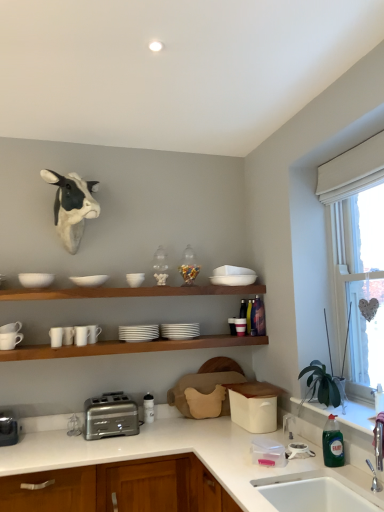
Where is `white matte mug at upper left, the 2th tableware positioned from the left`? The height and width of the screenshot is (512, 384). white matte mug at upper left, the 2th tableware positioned from the left is located at coordinates [56, 337].

What do you see at coordinates (36, 280) in the screenshot?
I see `white matte bowl at upper left, the second mixing bowl from the right` at bounding box center [36, 280].

This screenshot has width=384, height=512. Identify the location of beige plastic bread bin at lower center, which appears as the first appliance when viewed from the right. (254, 405).

The height and width of the screenshot is (512, 384). I want to click on white matte mug at upper left, which ranks as the 7th tableware in right-to-left order, so click(56, 337).

Would you say green glass bottle at lower right is to the left or to the right of white matte cow head at upper left in the picture?

Clearly, green glass bottle at lower right is on the right of white matte cow head at upper left in the image.

Can you see green glass bottle at lower right touching white matte cow head at upper left?

green glass bottle at lower right and white matte cow head at upper left are not in contact.

Can you confirm if green glass bottle at lower right is wider than white matte cow head at upper left?

No, green glass bottle at lower right is not wider than white matte cow head at upper left.

Can you confirm if white matte plates at center, arranged as the 1th tableware when viewed from the right, is positioned to the left of white glossy countertop at lower center?

In fact, white matte plates at center, arranged as the 1th tableware when viewed from the right, is to the right of white glossy countertop at lower center.

Based on the photo, from the image's perspective, does white matte plates at center, arranged as the 1th tableware when viewed from the right, appear higher than white glossy countertop at lower center?

Yes, from the image's perspective, white matte plates at center, arranged as the 1th tableware when viewed from the right, is above white glossy countertop at lower center.

Between white matte plates at center, which ranks as the eighth tableware in left-to-right order, and white glossy countertop at lower center, which one is positioned in front?

Positioned in front is white glossy countertop at lower center.

Would you consider white matte plates at center, arranged as the 1th tableware when viewed from the right, to be distant from white glossy countertop at lower center?

No, white matte plates at center, arranged as the 1th tableware when viewed from the right, is in close proximity to white glossy countertop at lower center.

Considering the relative sizes of white ceramic sink at lower right, which is counted as the first sink, starting from the top, and green glass bottle at lower right in the image provided, is white ceramic sink at lower right, which is counted as the first sink, starting from the top, taller than green glass bottle at lower right?

In fact, white ceramic sink at lower right, which is counted as the first sink, starting from the top, may be shorter than green glass bottle at lower right.

Who is smaller, white ceramic sink at lower right, the 2th sink in the bottom-to-top sequence, or green glass bottle at lower right?

green glass bottle at lower right.

From the image's perspective, which is above, white ceramic sink at lower right, which is counted as the first sink, starting from the top, or green glass bottle at lower right?

green glass bottle at lower right is shown above in the image.

Is white ceramic sink at lower right, which is counted as the first sink, starting from the top, not inside green glass bottle at lower right?

That's correct, white ceramic sink at lower right, which is counted as the first sink, starting from the top, is outside of green glass bottle at lower right.

Is white matte bowl at upper center, acting as the second mixing bowl starting from the left, aimed at white matte mug at upper left, which is counted as the 5th tableware, starting from the left?

No, white matte bowl at upper center, acting as the second mixing bowl starting from the left, is not aimed at white matte mug at upper left, which is counted as the 5th tableware, starting from the left.

In the scene shown: Is white matte bowl at upper center, positioned as the first mixing bowl in right-to-left order, with white matte mug at upper left, the 4th tableware positioned from the right?

They are not placed beside each other.

Between white matte bowl at upper center, acting as the second mixing bowl starting from the left, and white matte mug at upper left, which is counted as the 5th tableware, starting from the left, which one has more height?

white matte mug at upper left, which is counted as the 5th tableware, starting from the left, is taller.

Where is `the 1st mixing bowl in front of the white matte mug at upper left, the 4th tableware positioned from the right, starting your count from the anchor`? This screenshot has width=384, height=512. the 1st mixing bowl in front of the white matte mug at upper left, the 4th tableware positioned from the right, starting your count from the anchor is located at coordinates (89, 280).

From the picture: Is white matte cups at left, positioned as the 6th tableware in right-to-left order, positioned in front of white matte bowl at upper center, the 6th tableware in the left-to-right sequence?

Yes, the depth of white matte cups at left, positioned as the 6th tableware in right-to-left order, is less than that of white matte bowl at upper center, the 6th tableware in the left-to-right sequence.

Would you say white matte cups at left, positioned as the 6th tableware in right-to-left order, contains white matte bowl at upper center, which ranks as the third tableware in right-to-left order?

Actually, white matte bowl at upper center, which ranks as the third tableware in right-to-left order, is outside white matte cups at left, positioned as the 6th tableware in right-to-left order.

Which is more distant, (72,340) or (139,276)?

The point (139,276) is behind.

Considering the positions of objects white matte cups at left, which is the third tableware from left to right, and white matte bowl at upper center, which ranks as the third tableware in right-to-left order, in the image provided, who is more to the left, white matte cups at left, which is the third tableware from left to right, or white matte bowl at upper center, which ranks as the third tableware in right-to-left order,?

Positioned to the left is white matte cups at left, which is the third tableware from left to right.

Between beige plastic bread bin at lower center, the second appliance positioned from the left, and white ceramic sink at lower right, which appears as the first sink when ordered from the bottom, which one appears on the left side from the viewer's perspective?

beige plastic bread bin at lower center, the second appliance positioned from the left, is more to the left.

Locate an element on the screen. The image size is (384, 512). the 2nd appliance behind the white ceramic sink at lower right, which appears as the first sink when ordered from the bottom is located at coordinates (254, 405).

In terms of height, does beige plastic bread bin at lower center, which appears as the first appliance when viewed from the right, look taller or shorter compared to white ceramic sink at lower right, which appears as the first sink when ordered from the bottom?

Clearly, beige plastic bread bin at lower center, which appears as the first appliance when viewed from the right, is taller compared to white ceramic sink at lower right, which appears as the first sink when ordered from the bottom.

Who is shorter, white matte mug at upper left, the 2th tableware positioned from the left, or white ceramic sink at lower right, the 2th sink in the bottom-to-top sequence?

Standing shorter between the two is white matte mug at upper left, the 2th tableware positioned from the left.

From the image's perspective, is white matte mug at upper left, which ranks as the 7th tableware in right-to-left order, above or below white ceramic sink at lower right, which is counted as the first sink, starting from the top?

Clearly, from the image's perspective, white matte mug at upper left, which ranks as the 7th tableware in right-to-left order, is above white ceramic sink at lower right, which is counted as the first sink, starting from the top.

Where is `the 4th tableware located above the white ceramic sink at lower right, which is counted as the first sink, starting from the top (from a real-world perspective)`? the 4th tableware located above the white ceramic sink at lower right, which is counted as the first sink, starting from the top (from a real-world perspective) is located at coordinates (56, 337).

I want to click on cattle behind the green glass bottle at lower right, so click(x=72, y=206).

Image resolution: width=384 pixels, height=512 pixels. Identify the location of countertop below the white matte plates at center, arranged as the 1th tableware when viewed from the right (from the image's perspective). (180, 452).

Based on their spatial positions, is beige plastic bread bin at lower center, which appears as the first appliance when viewed from the right, or wooden shelf at upper center further from white matte plates at center, arranged as the 1th tableware when viewed from the right?

beige plastic bread bin at lower center, which appears as the first appliance when viewed from the right, is positioned further to the anchor white matte plates at center, arranged as the 1th tableware when viewed from the right.

Looking at the image, which one is located closer to clear glass window at right, white ceramic mug at left, which is the 8th tableware from right to left, or white matte bowl at upper center, the 6th tableware in the left-to-right sequence?

white matte bowl at upper center, the 6th tableware in the left-to-right sequence.

Looking at the image, which one is located closer to beige plastic bread bin at lower center, which appears as the first appliance when viewed from the right, white matte mug at upper left, which is counted as the 5th tableware, starting from the left, or white matte bowl at upper center, which ranks as the third tableware in right-to-left order?

Among the two, white matte bowl at upper center, which ranks as the third tableware in right-to-left order, is located nearer to beige plastic bread bin at lower center, which appears as the first appliance when viewed from the right.

Looking at the image, which one is located further to white glossy mug at left, placed as the 5th tableware when sorted from right to left, white glossy countertop at lower center or white matte mug at upper left, which ranks as the 7th tableware in right-to-left order?

white glossy countertop at lower center is positioned further to the anchor white glossy mug at left, placed as the 5th tableware when sorted from right to left.

When comparing their distances from wooden shelf at upper center, does white glossy countertop at lower center or white ceramic mug at left, which is the 8th tableware from right to left, seem further?

Based on the image, white glossy countertop at lower center appears to be further to wooden shelf at upper center.

Which object lies nearer to the anchor point white ceramic sink at lower right, which is counted as the first sink, starting from the top, clear glass window at right or brushed metal toaster at lower left, the second appliance viewed from the right?

Based on the image, clear glass window at right appears to be nearer to white ceramic sink at lower right, which is counted as the first sink, starting from the top.

Looking at the image, which one is located further to white matte cow head at upper left, green glass bottle at lower right or wooden shelf at upper center?

Among the two, green glass bottle at lower right is located further to white matte cow head at upper left.

Considering their positions, is clear glass window at right positioned closer to white matte cow head at upper left than white matte bowl at upper left, the second mixing bowl from the right?

white matte bowl at upper left, the second mixing bowl from the right, lies closer to white matte cow head at upper left than the other object.

I want to click on shelve between brushed metal toaster at lower left, the second appliance viewed from the right, and white glossy countertop at lower center, so click(x=128, y=347).

This screenshot has width=384, height=512. Find the location of `shelf that lies between white matte bowl at upper center, which ranks as the third tableware in right-to-left order, and satin silver toaster at lower center from top to bottom`. shelf that lies between white matte bowl at upper center, which ranks as the third tableware in right-to-left order, and satin silver toaster at lower center from top to bottom is located at coordinates (128, 292).

Locate an element on the screen. This screenshot has height=512, width=384. toaster situated between white glossy mug at left, which is the fourth tableware from left to right, and green glass bottle at lower right from left to right is located at coordinates [x=110, y=416].

Image resolution: width=384 pixels, height=512 pixels. I want to click on bottle between wooden shelf at upper center and white glossy countertop at lower center in the up-down direction, so [x=332, y=443].